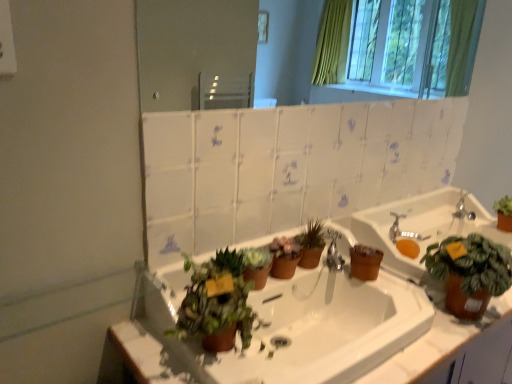
Image resolution: width=512 pixels, height=384 pixels. I want to click on green matte plant at center, placed as the 3th houseplant when sorted from right to left, so click(x=257, y=265).

What do you see at coordinates (311, 244) in the screenshot? This screenshot has height=384, width=512. I see `matte brown pot at center, arranged as the 3th houseplant when viewed from the left` at bounding box center [311, 244].

Locate an element on the screen. silver metallic faucet at upper right is located at coordinates (463, 209).

Image resolution: width=512 pixels, height=384 pixels. I want to click on green matte plant at lower center, marked as the first houseplant in a left-to-right arrangement, so (x=217, y=303).

Is white glossy sink at center, the first sink when ordered from left to right, turned away from green matte plant at lower center, marked as the first houseplant in a left-to-right arrangement?

No, white glossy sink at center, the first sink when ordered from left to right, is not facing away from green matte plant at lower center, marked as the first houseplant in a left-to-right arrangement.

Between white glossy sink at center, which ranks as the 2th sink in right-to-left order, and green matte plant at lower center, marked as the first houseplant in a left-to-right arrangement, which one appears on the right side from the viewer's perspective?

From the viewer's perspective, white glossy sink at center, which ranks as the 2th sink in right-to-left order, appears more on the right side.

Who is bigger, white glossy sink at center, which ranks as the 2th sink in right-to-left order, or green matte plant at lower center, marked as the first houseplant in a left-to-right arrangement?

With larger size is white glossy sink at center, which ranks as the 2th sink in right-to-left order.

Does silver metallic faucet at upper right appear on the left side of green matte plant at right, the 4th houseplant when ordered from left to right?

No.

Does silver metallic faucet at upper right lie behind green matte plant at right, positioned as the first houseplant in right-to-left order?

Yes, silver metallic faucet at upper right is further from the viewer.

Is silver metallic faucet at upper right taller than green matte plant at right, positioned as the first houseplant in right-to-left order?

In fact, silver metallic faucet at upper right may be shorter than green matte plant at right, positioned as the first houseplant in right-to-left order.

Between silver metallic faucet at upper right and green matte plant at right, positioned as the first houseplant in right-to-left order, which one has larger width?

green matte plant at right, positioned as the first houseplant in right-to-left order, is wider.

From the image's perspective, is silver metallic faucet at upper right above or below matte brown pot at center, arranged as the 3th houseplant when viewed from the left?

silver metallic faucet at upper right is above matte brown pot at center, arranged as the 3th houseplant when viewed from the left.

Between silver metallic faucet at upper right and matte brown pot at center, arranged as the 3th houseplant when viewed from the left, which one has more height?

Standing taller between the two is matte brown pot at center, arranged as the 3th houseplant when viewed from the left.

From a real-world perspective, who is located lower, silver metallic faucet at upper right or matte brown pot at center, the 2th houseplant positioned from the right?

From a 3D spatial view, silver metallic faucet at upper right is below.

Which is more to the left, silver metallic faucet at upper right or matte brown pot at center, arranged as the 3th houseplant when viewed from the left?

Positioned to the left is matte brown pot at center, arranged as the 3th houseplant when viewed from the left.

In the scene shown: Can you confirm if green matte plant at right, the 4th houseplant when ordered from left to right, is positioned to the right of silver metallic faucet at upper right?

In fact, green matte plant at right, the 4th houseplant when ordered from left to right, is to the left of silver metallic faucet at upper right.

From their relative heights in the image, would you say green matte plant at right, the 4th houseplant when ordered from left to right, is taller or shorter than silver metallic faucet at upper right?

green matte plant at right, the 4th houseplant when ordered from left to right, is taller than silver metallic faucet at upper right.

Is green matte plant at right, positioned as the first houseplant in right-to-left order, placed right next to silver metallic faucet at upper right?

They are not placed beside each other.

Does green matte plant at right, positioned as the first houseplant in right-to-left order, have a larger size compared to silver metallic faucet at upper right?

Indeed, green matte plant at right, positioned as the first houseplant in right-to-left order, has a larger size compared to silver metallic faucet at upper right.

Is matte brown pot at center, the 2th houseplant positioned from the right, not near silver metallic faucet at upper right?

That's not correct — matte brown pot at center, the 2th houseplant positioned from the right, is a little close to silver metallic faucet at upper right.

Is matte brown pot at center, arranged as the 3th houseplant when viewed from the left, thinner than silver metallic faucet at upper right?

Yes.

How different are the orientations of matte brown pot at center, arranged as the 3th houseplant when viewed from the left, and silver metallic faucet at upper right in degrees?

They differ by 34.9 degrees in their facing directions.

From the picture: Is silver metallic faucet at upper right positioned behind green matte plant at center, placed as the 3th houseplant when sorted from right to left?

Yes, it is behind green matte plant at center, placed as the 3th houseplant when sorted from right to left.

Considering the relative sizes of silver metallic faucet at upper right and green matte plant at center, placed as the 3th houseplant when sorted from right to left, in the image provided, is silver metallic faucet at upper right thinner than green matte plant at center, placed as the 3th houseplant when sorted from right to left,?

No, silver metallic faucet at upper right is not thinner than green matte plant at center, placed as the 3th houseplant when sorted from right to left.

Would you say silver metallic faucet at upper right is outside green matte plant at center, which ranks as the 2th houseplant in left-to-right order?

Absolutely, silver metallic faucet at upper right is external to green matte plant at center, which ranks as the 2th houseplant in left-to-right order.

Is green matte plant at center, which ranks as the 2th houseplant in left-to-right order, bigger than matte brown pot at center, arranged as the 3th houseplant when viewed from the left?

No, green matte plant at center, which ranks as the 2th houseplant in left-to-right order, is not bigger than matte brown pot at center, arranged as the 3th houseplant when viewed from the left.

Is point (251, 270) positioned before point (312, 225)?

Yes.

Would you say matte brown pot at center, the 2th houseplant positioned from the right, is part of green matte plant at center, placed as the 3th houseplant when sorted from right to left,'s contents?

No, matte brown pot at center, the 2th houseplant positioned from the right, is located outside of green matte plant at center, placed as the 3th houseplant when sorted from right to left.

The width and height of the screenshot is (512, 384). Find the location of `the 2nd houseplant counting from the left of the white glossy sink at center, the first sink when ordered from left to right`. the 2nd houseplant counting from the left of the white glossy sink at center, the first sink when ordered from left to right is located at coordinates (217, 303).

The width and height of the screenshot is (512, 384). Find the location of `the 3rd houseplant in front of the silver metallic faucet at upper right, starting your count from the anchor`. the 3rd houseplant in front of the silver metallic faucet at upper right, starting your count from the anchor is located at coordinates (469, 272).

Looking at the image, which one is located closer to matte brown pot at center, the 2th houseplant positioned from the right, matte brown sink at right, the first sink viewed from the right, or silver metallic faucet at upper right?

matte brown sink at right, the first sink viewed from the right, is positioned closer to the anchor matte brown pot at center, the 2th houseplant positioned from the right.

From the image, which object appears to be nearer to green matte plant at right, positioned as the first houseplant in right-to-left order, white glossy sink at center, the first sink when ordered from left to right, or green matte plant at center, placed as the 3th houseplant when sorted from right to left?

Among the two, white glossy sink at center, the first sink when ordered from left to right, is located nearer to green matte plant at right, positioned as the first houseplant in right-to-left order.

When comparing their distances from green matte plant at lower center, the 4th houseplant positioned from the right, does matte brown sink at right, the 2th sink positioned from the left, or silver metallic faucet at upper right seem closer?

matte brown sink at right, the 2th sink positioned from the left, is closer to green matte plant at lower center, the 4th houseplant positioned from the right.

From the image, which object appears to be nearer to matte brown sink at right, the first sink viewed from the right, matte brown pot at center, the 2th houseplant positioned from the right, or matte white mirror at upper center?

Based on the image, matte brown pot at center, the 2th houseplant positioned from the right, appears to be nearer to matte brown sink at right, the first sink viewed from the right.

Considering their positions, is silver metallic faucet at upper right positioned closer to silver metallic faucet at upper right than green matte plant at right, the 4th houseplant when ordered from left to right?

silver metallic faucet at upper right.

Considering their positions, is green matte plant at lower center, the 4th houseplant positioned from the right, positioned further to matte brown sink at right, the first sink viewed from the right, than green matte plant at center, which ranks as the 2th houseplant in left-to-right order?

Based on the image, green matte plant at lower center, the 4th houseplant positioned from the right, appears to be further to matte brown sink at right, the first sink viewed from the right.

From the picture: Based on their spatial positions, is matte brown pot at center, the 2th houseplant positioned from the right, or silver metallic faucet at upper right closer to green matte plant at right, the 4th houseplant when ordered from left to right?

silver metallic faucet at upper right is closer to green matte plant at right, the 4th houseplant when ordered from left to right.

When comparing their distances from matte brown pot at center, arranged as the 3th houseplant when viewed from the left, does matte white mirror at upper center or matte brown sink at right, the first sink viewed from the right, seem further?

Based on the image, matte white mirror at upper center appears to be further to matte brown pot at center, arranged as the 3th houseplant when viewed from the left.

This screenshot has height=384, width=512. I want to click on faucet between green matte plant at center, which ranks as the 2th houseplant in left-to-right order, and green matte plant at right, positioned as the first houseplant in right-to-left order, so click(x=403, y=231).

Image resolution: width=512 pixels, height=384 pixels. Identify the location of sink between white glossy sink at center, the first sink when ordered from left to right, and silver metallic faucet at upper right in the front-back direction. (422, 226).

Find the location of a particular element. This screenshot has width=512, height=384. faucet between matte white mirror at upper center and white glossy sink at center, the first sink when ordered from left to right, in the vertical direction is located at coordinates (403, 231).

Find the location of a particular element. This screenshot has height=384, width=512. faucet positioned between green matte plant at right, the 4th houseplant when ordered from left to right, and silver metallic faucet at upper right from near to far is located at coordinates (403, 231).